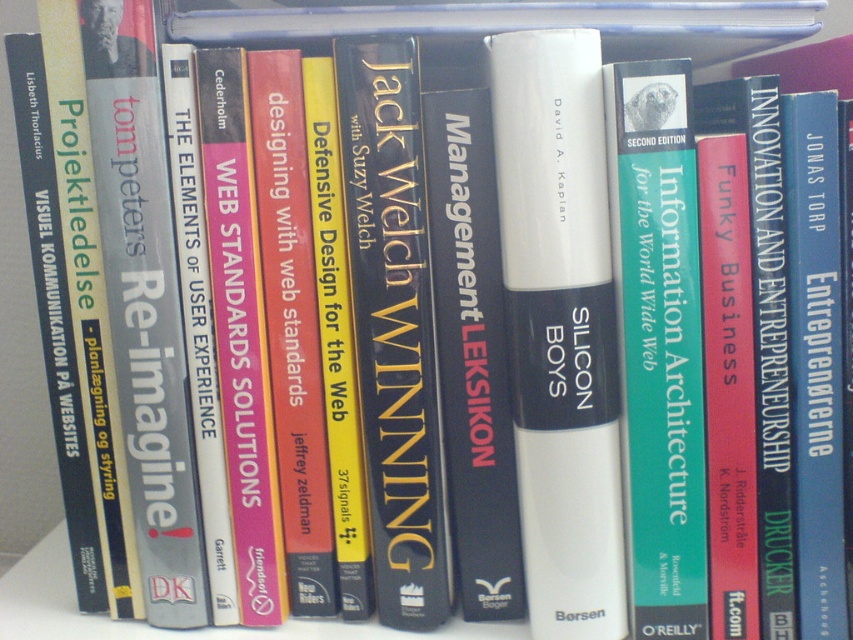
Question: Among these points, which one is farthest from the camera?

Choices:
 (A) (525, 477)
 (B) (701, 586)
 (C) (368, 477)

Answer: (C)

Question: Among these objects, which one is farthest from the camera?

Choices:
 (A) hardcover book at center
 (B) white matte book at center

Answer: (A)

Question: Does white matte book at center appear on the right side of green matte book at center?

Choices:
 (A) no
 (B) yes

Answer: (A)

Question: Is white matte book at center positioned in front of green matte book at center?

Choices:
 (A) no
 (B) yes

Answer: (A)

Question: Can you confirm if white matte book at center is smaller than green matte book at center?

Choices:
 (A) no
 (B) yes

Answer: (A)

Question: Which point is farther to the camera?

Choices:
 (A) (496, 77)
 (B) (404, 74)
 (C) (666, 188)

Answer: (B)